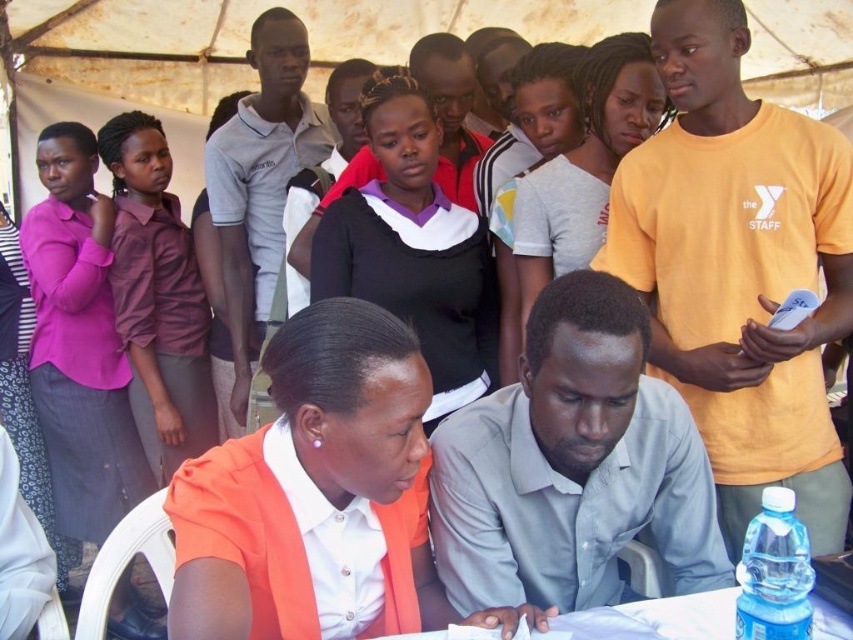
You are organizing a clothing donation drive and need to categorize shirts by size. You have two shirts to sort out. The first is a gray cotton shirt at center, and the second is a light gray cotton shirt at upper center. Which shirt should you place in the larger size bin?

The gray cotton shirt at center has a greater width than the light gray cotton shirt at upper center, so it should be placed in the larger size bin.

You are standing at the center of the image. There is a point marked at coordinate (318, 497). What object is located at that point?

The orange fabric shirt at lower center is located at point (318, 497).